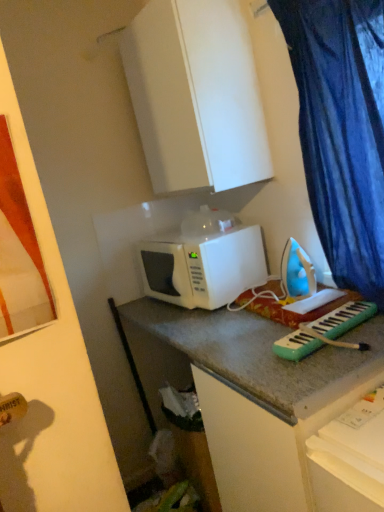
Question: Is white matte cabinet at upper center aimed at blue plastic iron at center-right?

Choices:
 (A) yes
 (B) no

Answer: (B)

Question: Is blue plastic iron at center-right located within white matte cabinet at upper center?

Choices:
 (A) yes
 (B) no

Answer: (B)

Question: Is white matte cabinet at upper center bigger than blue plastic iron at center-right?

Choices:
 (A) yes
 (B) no

Answer: (A)

Question: Can you confirm if white matte cabinet at upper center is smaller than blue plastic iron at center-right?

Choices:
 (A) no
 (B) yes

Answer: (A)

Question: Considering the relative sizes of white matte cabinet at upper center and blue plastic iron at center-right in the image provided, is white matte cabinet at upper center wider than blue plastic iron at center-right?

Choices:
 (A) yes
 (B) no

Answer: (A)

Question: Would you say blue fabric curtain at right is to the left or to the right of white matte cabinet at upper center in the picture?

Choices:
 (A) right
 (B) left

Answer: (A)

Question: Is point (283, 26) closer or farther from the camera than point (208, 143)?

Choices:
 (A) closer
 (B) farther

Answer: (A)

Question: From the image's perspective, is blue fabric curtain at right located above or below white matte cabinet at upper center?

Choices:
 (A) above
 (B) below

Answer: (B)

Question: Based on their sizes in the image, would you say blue fabric curtain at right is bigger or smaller than white matte cabinet at upper center?

Choices:
 (A) small
 (B) big

Answer: (A)

Question: Is blue plastic iron at center-right spatially inside green plastic keyboard at center-right, or outside of it?

Choices:
 (A) outside
 (B) inside

Answer: (A)

Question: In terms of width, does blue plastic iron at center-right look wider or thinner when compared to green plastic keyboard at center-right?

Choices:
 (A) thin
 (B) wide

Answer: (A)

Question: Based on their sizes in the image, would you say blue plastic iron at center-right is bigger or smaller than green plastic keyboard at center-right?

Choices:
 (A) small
 (B) big

Answer: (B)

Question: In terms of height, does blue plastic iron at center-right look taller or shorter compared to green plastic keyboard at center-right?

Choices:
 (A) short
 (B) tall

Answer: (B)

Question: Looking at their shapes, would you say white matte cabinet at upper center is wider or thinner than white matte microwave at center?

Choices:
 (A) wide
 (B) thin

Answer: (B)

Question: From a real-world perspective, relative to white matte microwave at center, is white matte cabinet at upper center vertically above or below?

Choices:
 (A) below
 (B) above

Answer: (B)